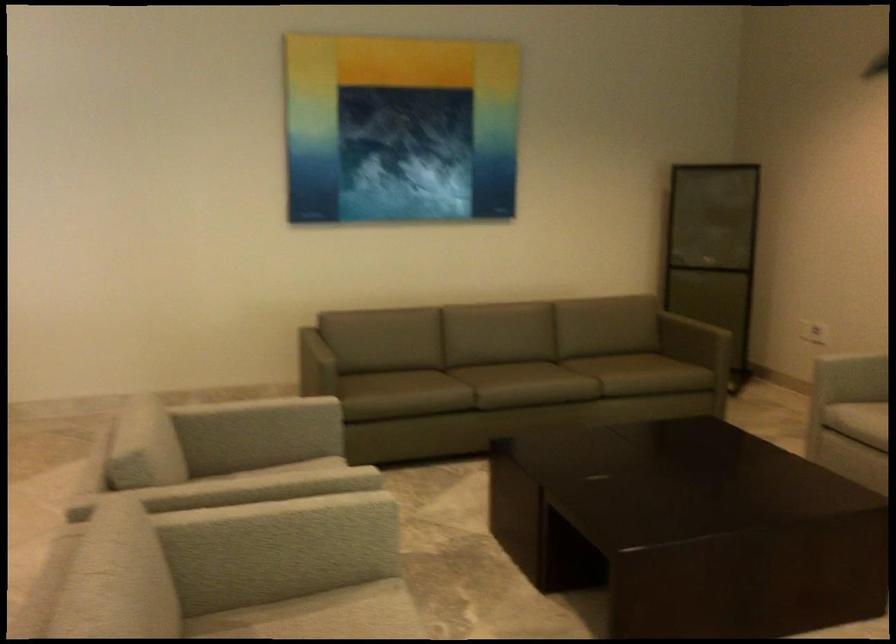
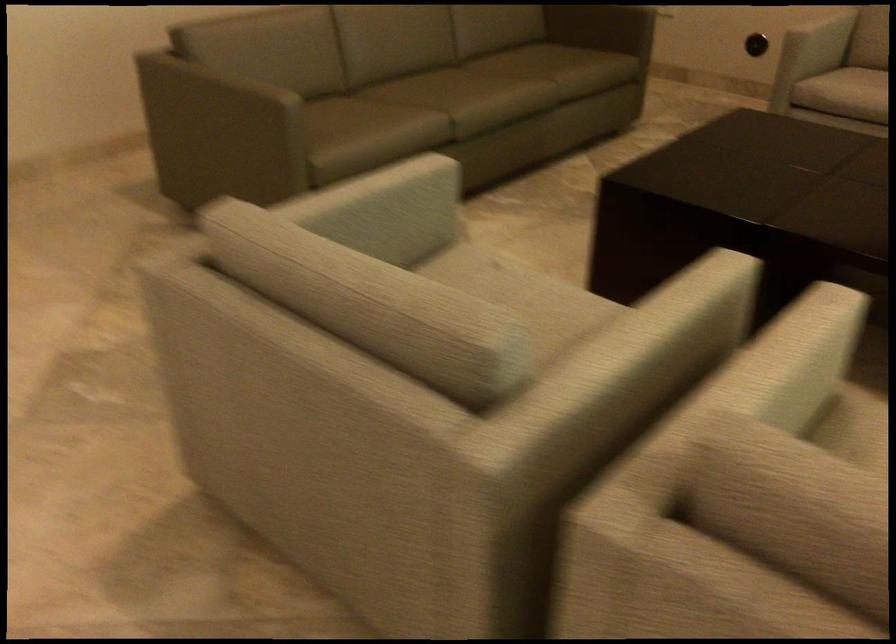
Find the pixel in the second image that matches the point at 234,494 in the first image.

(659, 332)